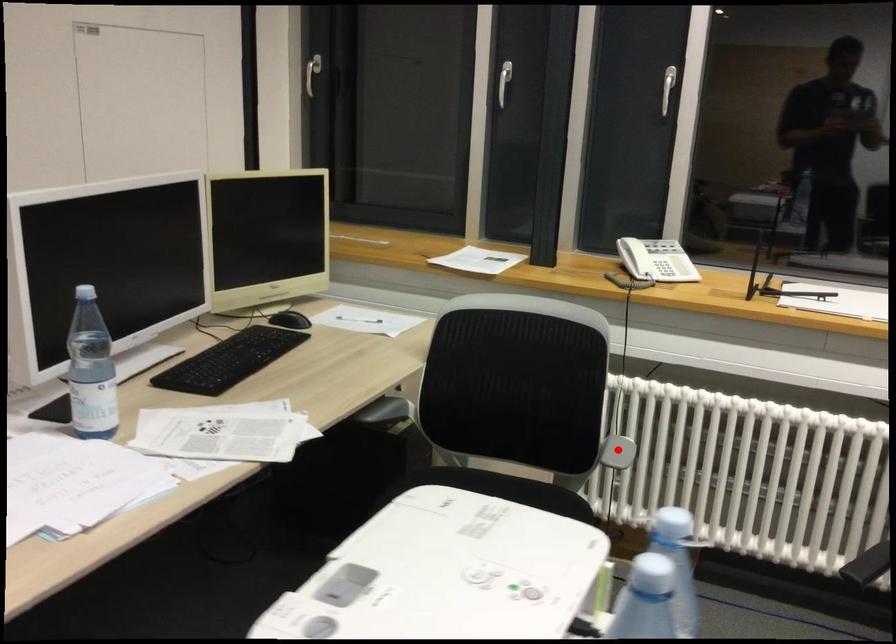
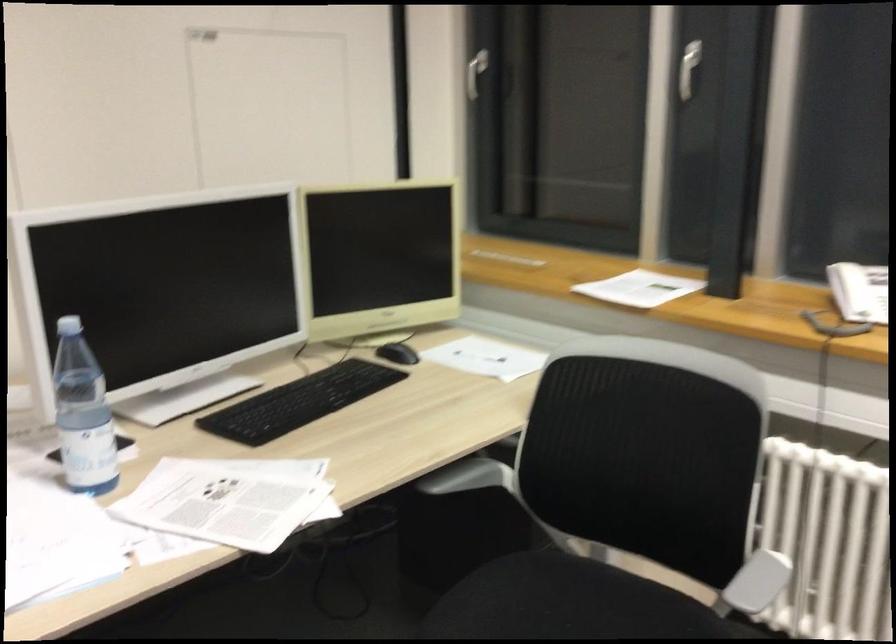
In the second image, find the point that corresponds to the highlighted location in the first image.

(757, 582)